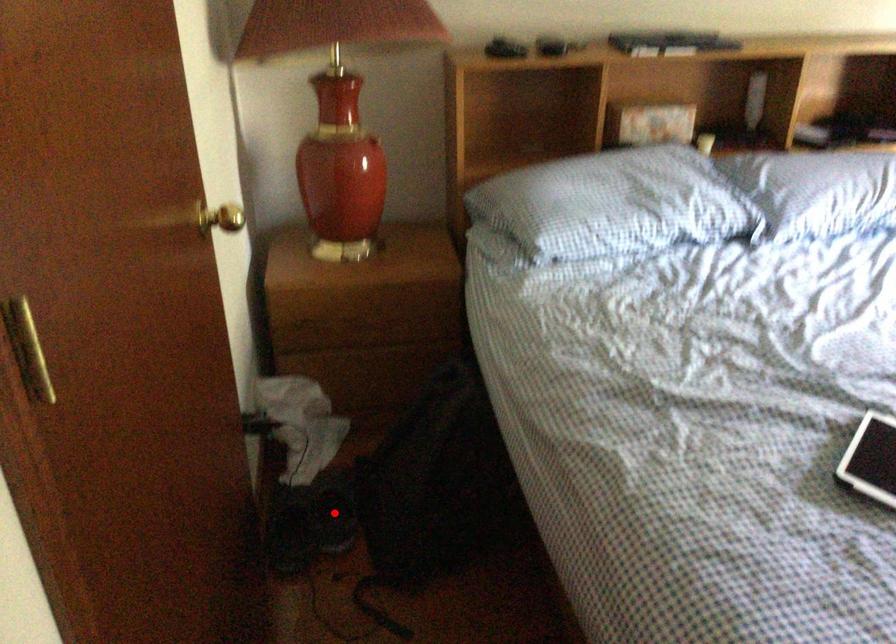
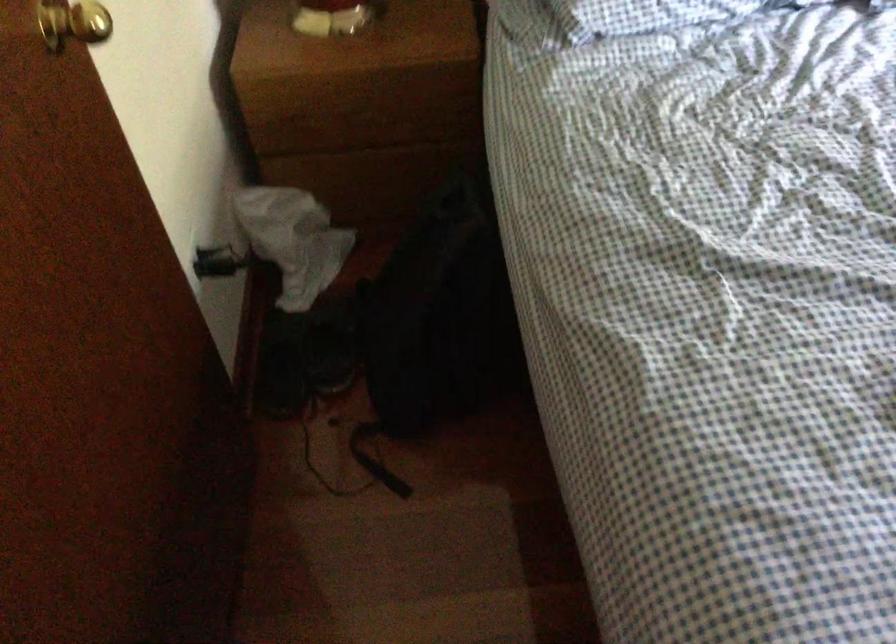
Question: I am providing you with two images of the same scene from different viewpoints. Given a red point in image1, look at the same physical point in image2. Is it:

Choices:
 (A) Closer to the viewpoint
 (B) Farther from the viewpoint

Answer: (A)